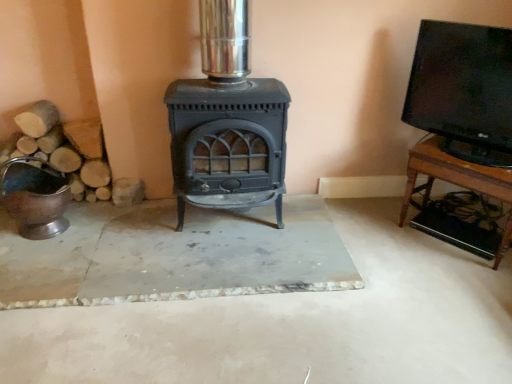
Find the location of a particular element. The image size is (512, 384). free space on the front side of matte black wood burning stove at center is located at coordinates (224, 264).